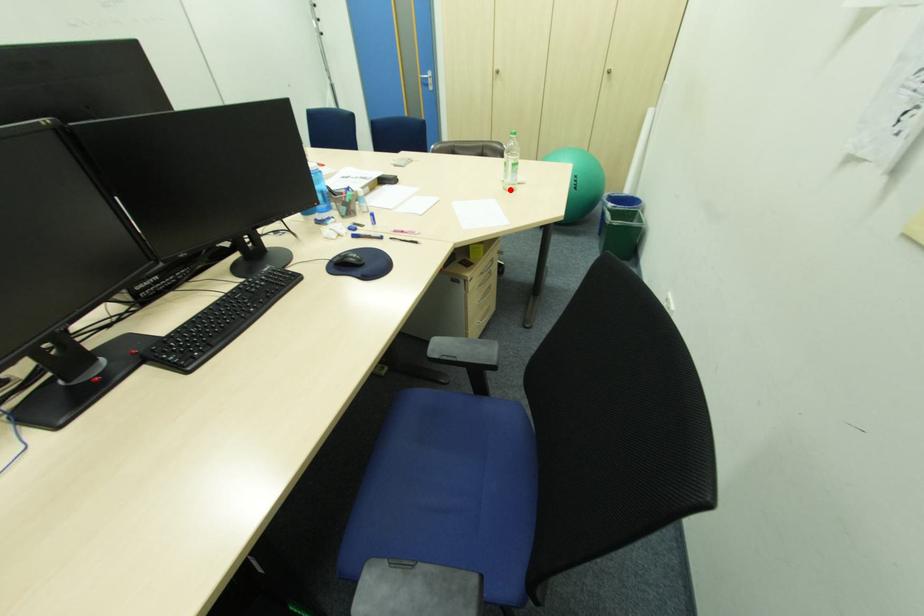
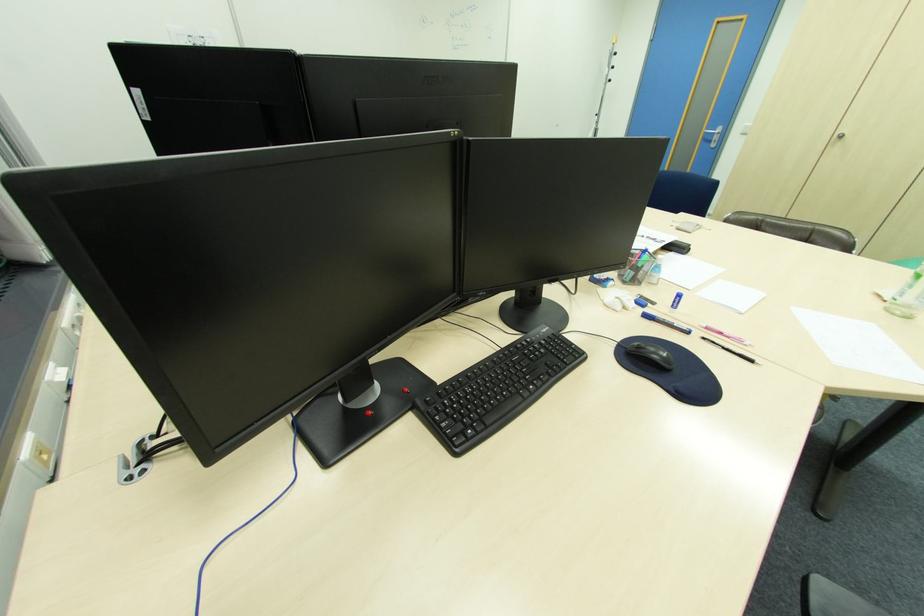
Question: I am providing you with two images of the same scene from different viewpoints. Image1 has a red point marked. In image2, the corresponding 3D location appears at what relative position? Reply with the corresponding letter.

Choices:
 (A) Closer
 (B) Farther

Answer: (B)